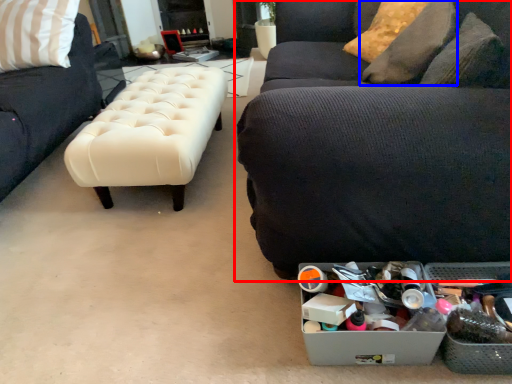
Question: Which object is closer to the camera taking this photo, studio couch (highlighted by a red box) or pillow (highlighted by a blue box)?

Choices:
 (A) studio couch
 (B) pillow

Answer: (A)